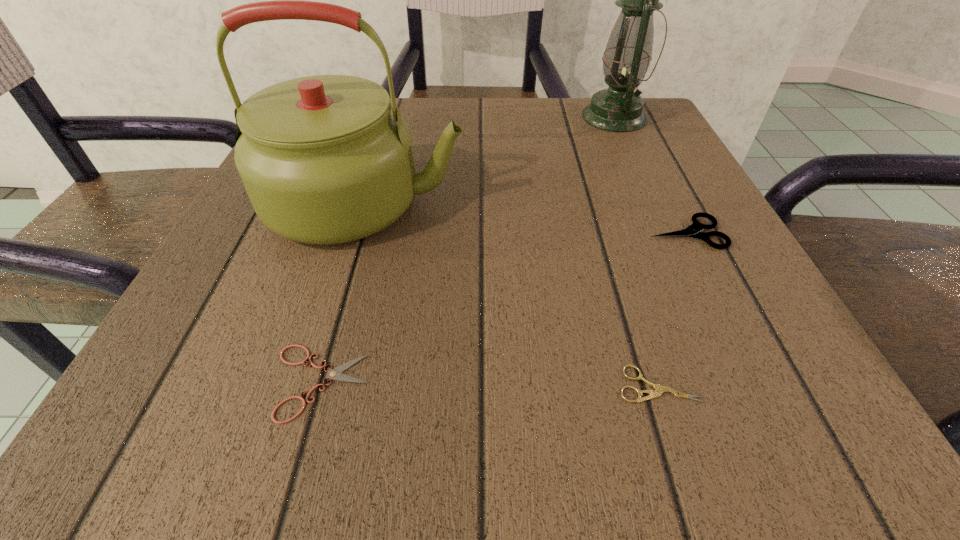
At what (x,y) coordinates should I click in order to perform the action: click on free space that satisfies the following two spatial constraints: 1. on the back side of the farthest shears; 2. on the right side of the second shears from left to right. Please return your answer as a coordinate pair (x, y). The height and width of the screenshot is (540, 960). Looking at the image, I should click on (612, 233).